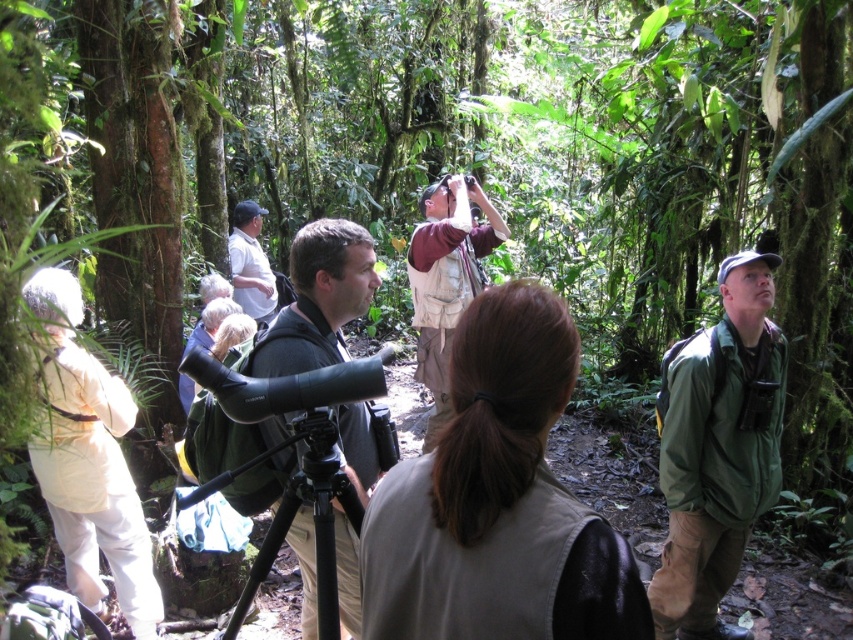
You are standing at the point labeled as point (357, 595) in the forest. You want to move 3 meters forward in the direction you are facing. Will you exit the forest area?

The distance between point (357, 595) and the viewer is 2.56 meters. Since you want to move 3 meters forward, which is farther than the current distance to the viewer, you would exit the forest area.

You are part of a birdwatching group in the forest. You notice two people wearing the green fabric jacket at center and the white shirt at center. Which one is positioned to the right?

The green fabric jacket at center is to the right of the white shirt at center.

You are part of the birdwatching group and want to hand the binoculars to your friend who is standing to your right. Which binoculars should you hand over so they can easily reach them without stretching? The options are the black matte binoculars at center and the maroon fabric binoculars at center.

You should hand over the maroon fabric binoculars at center because they are positioned to the right of the black matte binoculars at center, making them easier for your friend to reach without stretching.